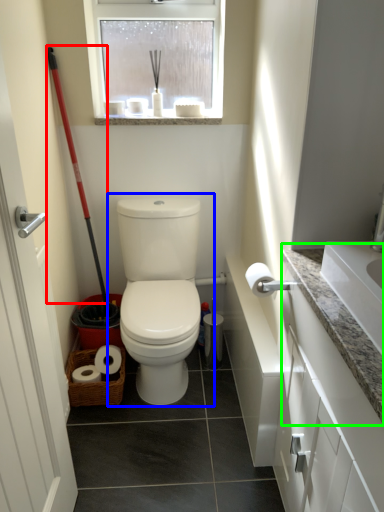
Question: Which object is positioned farthest from shovel (highlighted by a red box)? Select from toilet (highlighted by a blue box) and counter top (highlighted by a green box).

Choices:
 (A) toilet
 (B) counter top

Answer: (B)